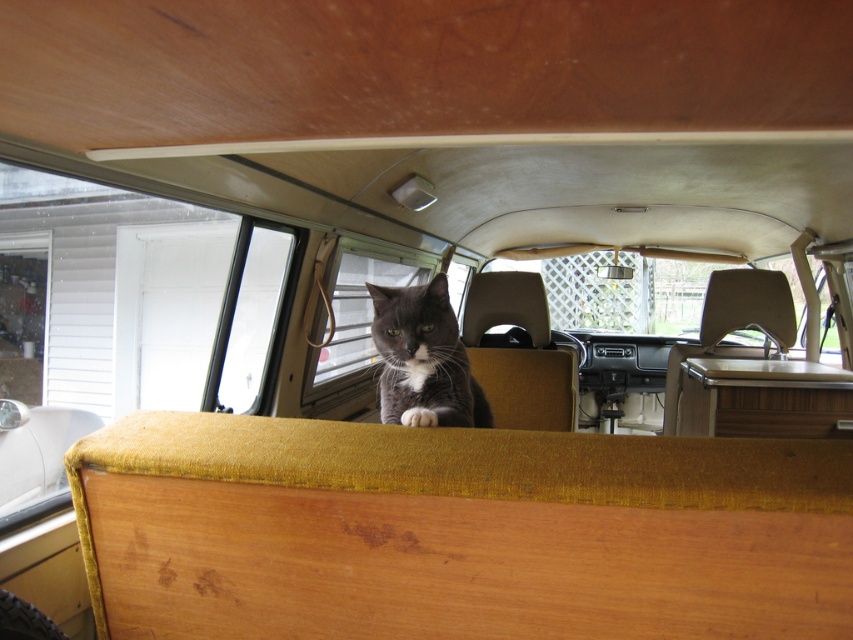
You are inside the vintage van and want to touch both points marked on the dashboard. Which point, point (409, 410) or point (426, 262), will you reach first if you extend your hand forward?

Point (409, 410) is closer to the viewer than point (426, 262), so you will reach point (409, 410) first.

You are driving a vintage van and want to let your cat get some fresh air. The gray fur cat at center is currently sitting on the passenger seat. Can the cat reach the clear glass window at center to stick its head out?

The gray fur cat at center is 6.62 feet away from the clear glass window at center. Since cats typically have a body length of around 2 feet, the distance between them is too great for the cat to reach the window without assistance.

You are a delivery person who needs to place a small package on the dashboard of the vintage vehicle. The dashboard is located in front of the gray fur cat at center. Can you place the package directly in front of the cat without it being in the way?

The gray fur cat at center is located at point (422, 358), which means it is positioned near the center of the vehicle. Since the dashboard is in front of the cat, there should be enough space to place the package directly in front of the cat without obstruction.